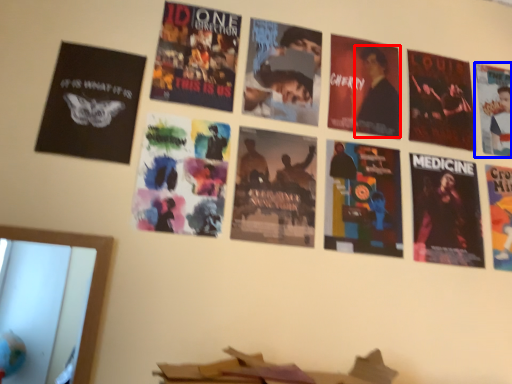
Question: Which object is further to the camera taking this photo, person (highlighted by a red box) or poster (highlighted by a blue box)?

Choices:
 (A) person
 (B) poster

Answer: (B)